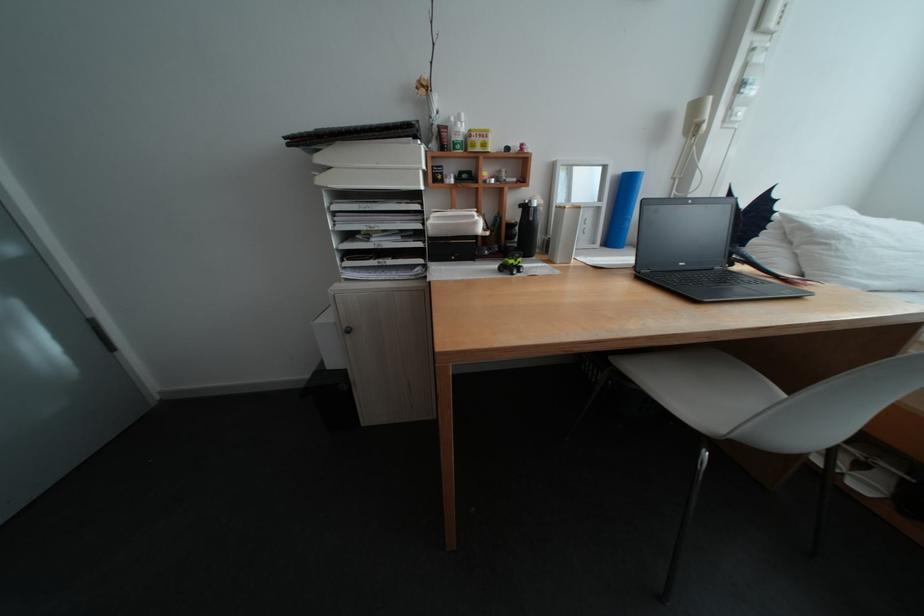
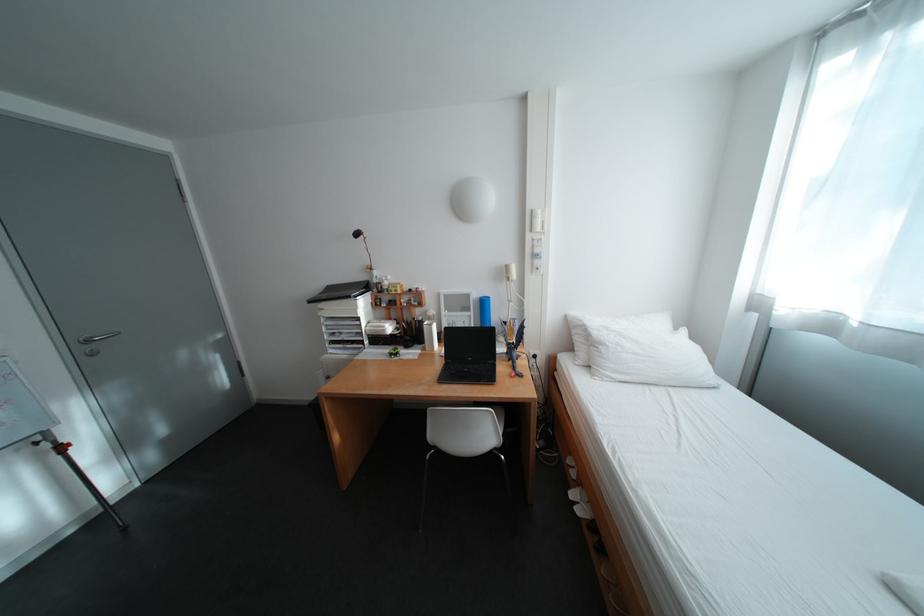
Where in the second image is the point corresponding to point 759,42 from the first image?

(541, 237)